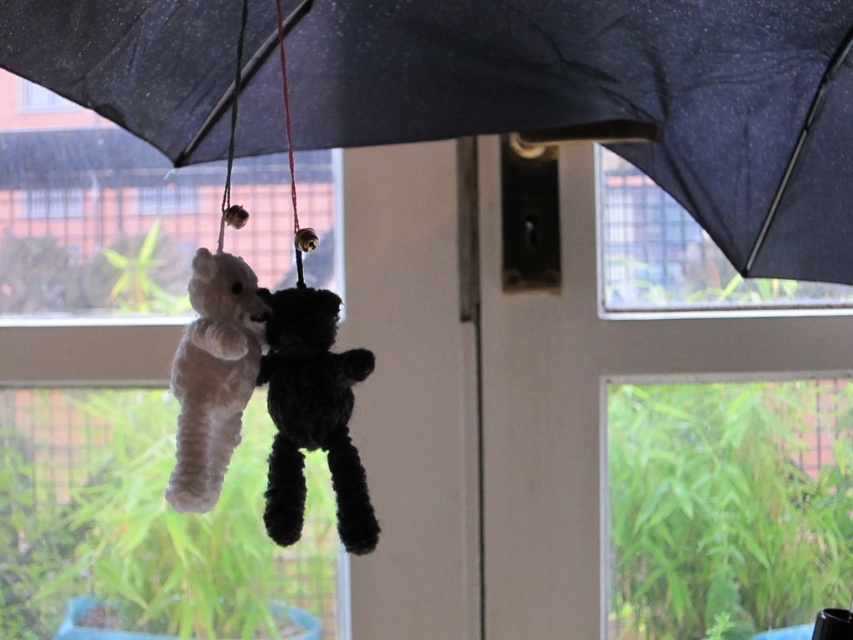
Consider the image. You are trying to hang a new decoration that requires knowing the size of the black matte umbrella at upper center and the transparent glass window at upper left. Which one has a greater width?

The black matte umbrella at upper center has a greater width than the transparent glass window at upper left according to the description.

You are a delivery robot with a package that is 16 inches wide. You need to pass through the space between the black matte umbrella at upper center and the transparent glass window at upper left. Can your package fit through this space?

The space between the black matte umbrella at upper center and the transparent glass window at upper left is 16.45 inches. Since the package is 16 inches wide, it can fit through the space as it is slightly narrower than the available gap.

You are a child trying to reach the black fuzzy bear at center hanging from the black matte umbrella at upper center. The distance between them is 9.77 inches. If your hand can reach up to 10 inches, can you grab the bear?

The distance between the black matte umbrella at upper center and the black fuzzy bear at center is 9.77 inches. Since your hand can reach up to 10 inches, you can grab the bear.